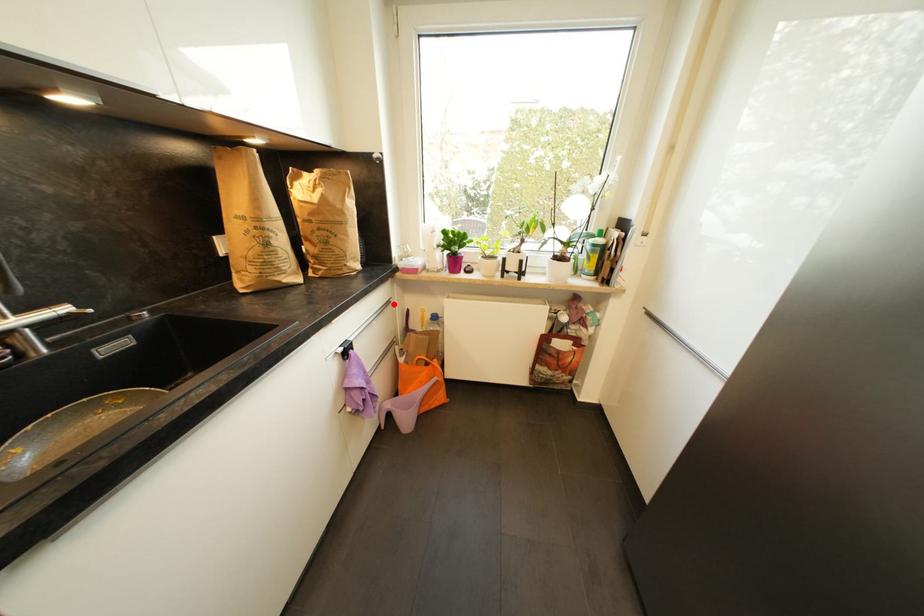
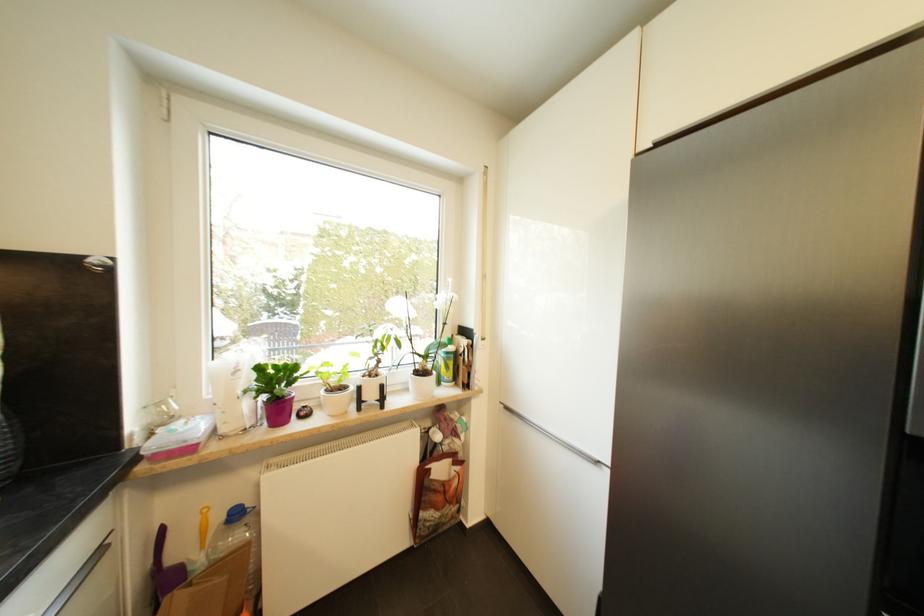
Question: I am providing you with two images of the same scene from different viewpoints. A red point is shown in image1. For the corresponding object point in image2, is it positioned nearer or farther from the camera?

Choices:
 (A) Nearer
 (B) Farther

Answer: (B)